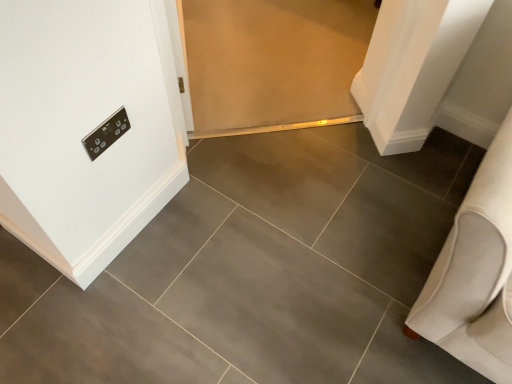
Question: In terms of height, does white fabric sofa at right look taller or shorter compared to satin silver switch at upper left?

Choices:
 (A) short
 (B) tall

Answer: (B)

Question: Is white fabric sofa at right wider or thinner than satin silver switch at upper left?

Choices:
 (A) wide
 (B) thin

Answer: (A)

Question: From the image's perspective, is white fabric sofa at right above or below satin silver switch at upper left?

Choices:
 (A) above
 (B) below

Answer: (B)

Question: Considering their positions, is satin silver switch at upper left located in front of or behind white fabric sofa at right?

Choices:
 (A) behind
 (B) front

Answer: (A)

Question: From a real-world perspective, is satin silver switch at upper left above or below white fabric sofa at right?

Choices:
 (A) above
 (B) below

Answer: (A)

Question: In terms of size, does satin silver switch at upper left appear bigger or smaller than white fabric sofa at right?

Choices:
 (A) small
 (B) big

Answer: (A)

Question: Considering the positions of satin silver switch at upper left and white fabric sofa at right in the image, is satin silver switch at upper left wider or thinner than white fabric sofa at right?

Choices:
 (A) thin
 (B) wide

Answer: (A)